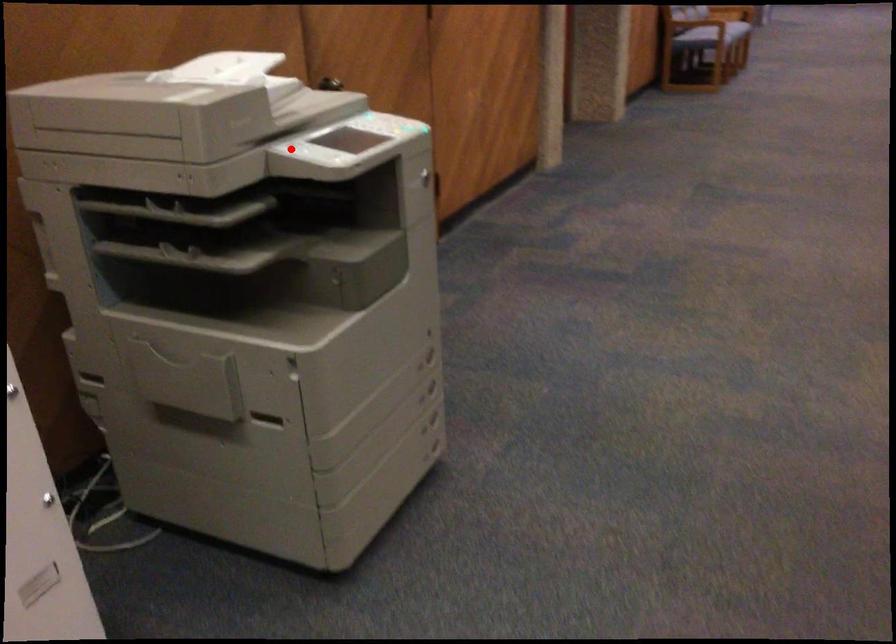
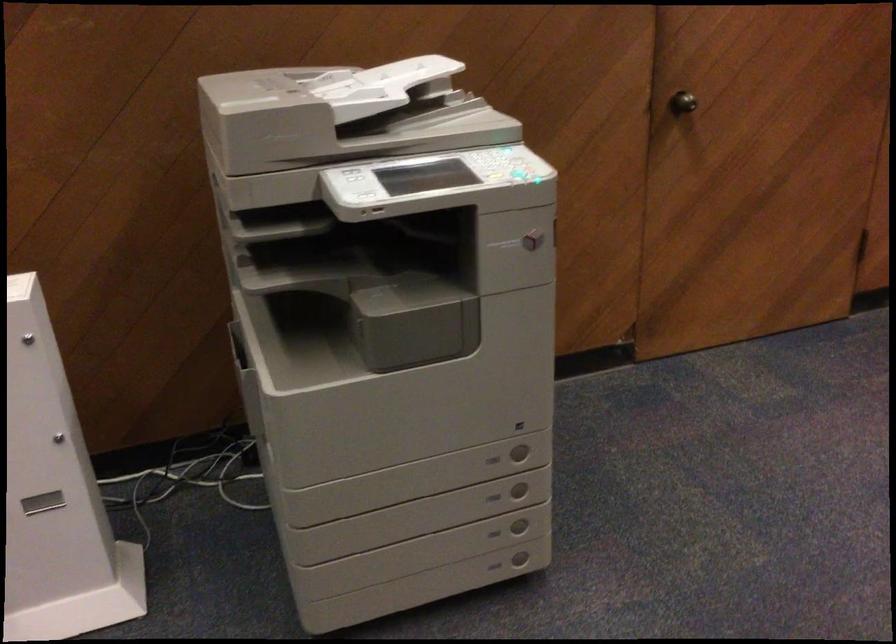
Question: I am providing you with two images of the same scene from different viewpoints. In image1, a red point is highlighted. Considering the same 3D point in image2, which of the following is correct?

Choices:
 (A) It is closer
 (B) It is farther

Answer: (A)